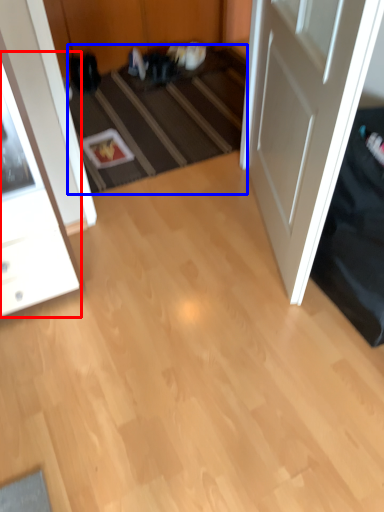
Question: Among these objects, which one is nearest to the camera, cabinetry (highlighted by a red box) or stair (highlighted by a blue box)?

Choices:
 (A) cabinetry
 (B) stair

Answer: (A)